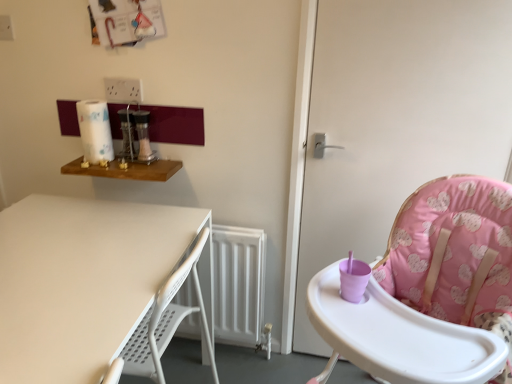
The image size is (512, 384). Identify the location of wooden shelf at upper left, positioned as the 2th table in bottom-to-top order. (126, 170).

This screenshot has height=384, width=512. What do you see at coordinates (95, 131) in the screenshot? I see `white paper towel at upper left` at bounding box center [95, 131].

Where is `white matte table at lower left, which is the first table in bottom-to-top order`? The image size is (512, 384). white matte table at lower left, which is the first table in bottom-to-top order is located at coordinates (81, 281).

Measure the distance between white matte table at lower left, which is the first table in bottom-to-top order, and camera.

They are 32.70 inches apart.

What do you see at coordinates (396, 120) in the screenshot?
I see `pink fabric high chair at right` at bounding box center [396, 120].

What is the approximate width of pink fabric high chair at right?

pink fabric high chair at right is 7.36 centimeters in width.

The height and width of the screenshot is (384, 512). I want to click on wooden shelf at upper left, positioned as the 2th table in bottom-to-top order, so click(126, 170).

Which object is positioned more to the left, wooden shelf at upper left, positioned as the 2th table in bottom-to-top order, or pink fabric high chair at right?

wooden shelf at upper left, positioned as the 2th table in bottom-to-top order.

From the picture: Considering the sizes of wooden shelf at upper left, positioned as the 2th table in bottom-to-top order, and pink fabric high chair at right in the image, is wooden shelf at upper left, positioned as the 2th table in bottom-to-top order, bigger or smaller than pink fabric high chair at right?

Clearly, wooden shelf at upper left, positioned as the 2th table in bottom-to-top order, is smaller in size than pink fabric high chair at right.

Considering the relative sizes of wooden shelf at upper left, which ranks as the 1th table in top-to-bottom order, and pink fabric high chair at right in the image provided, is wooden shelf at upper left, which ranks as the 1th table in top-to-bottom order, wider than pink fabric high chair at right?

Yes, wooden shelf at upper left, which ranks as the 1th table in top-to-bottom order, is wider than pink fabric high chair at right.

Which is behind, point (152, 169) or point (394, 131)?

The point (152, 169) is behind.

In the scene shown: What's the angular difference between white paper towel at upper left and white matte table at lower left, the 2th table from the top,'s facing directions?

90 degrees.

Is white paper towel at upper left placed right next to white matte table at lower left, the 2th table from the top?

No, white paper towel at upper left is not touching white matte table at lower left, the 2th table from the top.

Is point (101, 104) positioned behind point (71, 358)?

Yes, it is.

From the image's perspective, is white paper towel at upper left located above or below white matte table at lower left, the 2th table from the top?

Clearly, from the image's perspective, white paper towel at upper left is above white matte table at lower left, the 2th table from the top.

Would you say white matte table at lower left, the 2th table from the top, is inside or outside pink fabric high chair at right?

white matte table at lower left, the 2th table from the top, cannot be found inside pink fabric high chair at right.

Can you tell me how much white matte table at lower left, the 2th table from the top, and pink fabric high chair at right differ in facing direction?

white matte table at lower left, the 2th table from the top, and pink fabric high chair at right are facing 90 degrees away from each other.

Considering the positions of point (129, 313) and point (407, 194), is point (129, 313) closer or farther from the camera than point (407, 194)?

Point (129, 313) is positioned closer to the camera compared to point (407, 194).

Visually, is white matte table at lower left, the 2th table from the top, positioned to the left or to the right of pink fabric high chair at right?

Clearly, white matte table at lower left, the 2th table from the top, is on the left of pink fabric high chair at right in the image.

The width and height of the screenshot is (512, 384). I want to click on chair above the white matte table at lower left, the 2th table from the top (from a real-world perspective), so click(430, 290).

From the picture: Is pink fabric highchair at right bigger or smaller than white matte table at lower left, the 2th table from the top?

Clearly, pink fabric highchair at right is larger in size than white matte table at lower left, the 2th table from the top.

Visually, is pink fabric highchair at right positioned to the left or to the right of white matte table at lower left, which is the first table in bottom-to-top order?

In the image, pink fabric highchair at right appears on the right side of white matte table at lower left, which is the first table in bottom-to-top order.

From the image's perspective, which object appears higher, pink fabric highchair at right or white matte table at lower left, the 2th table from the top?

From the image's view, pink fabric highchair at right is above.

Does pink fabric highchair at right touch pink fabric high chair at right?

There is a gap between pink fabric highchair at right and pink fabric high chair at right.

From the image's perspective, who appears lower, pink fabric highchair at right or pink fabric high chair at right?

From the image's view, pink fabric highchair at right is below.

The height and width of the screenshot is (384, 512). Find the location of `screen door that is above the pink fabric highchair at right (from the image's perspective)`. screen door that is above the pink fabric highchair at right (from the image's perspective) is located at coordinates (396, 120).

Considering their positions, is pink fabric highchair at right located in front of or behind pink fabric high chair at right?

A: In the image, pink fabric highchair at right appears in front of pink fabric high chair at right.

Is point (100, 171) positioned behind point (45, 222)?

Yes, it is.

Is wooden shelf at upper left, which ranks as the 1th table in top-to-bottom order, wider or thinner than white matte table at lower left, the 2th table from the top?

Clearly, wooden shelf at upper left, which ranks as the 1th table in top-to-bottom order, has less width compared to white matte table at lower left, the 2th table from the top.

Can you confirm if wooden shelf at upper left, positioned as the 2th table in bottom-to-top order, is positioned to the left of white matte table at lower left, the 2th table from the top?

Indeed, wooden shelf at upper left, positioned as the 2th table in bottom-to-top order, is positioned on the left side of white matte table at lower left, the 2th table from the top.

Could you tell me if wooden shelf at upper left, which ranks as the 1th table in top-to-bottom order, is facing white matte table at lower left, the 2th table from the top?

No, wooden shelf at upper left, which ranks as the 1th table in top-to-bottom order, is not oriented towards white matte table at lower left, the 2th table from the top.

Can you confirm if white matte table at lower left, which is the first table in bottom-to-top order, is smaller than white paper towel at upper left?

No.

Is point (160, 239) positioned after point (89, 147)?

That is False.

Who is taller, white matte table at lower left, the 2th table from the top, or white paper towel at upper left?

white matte table at lower left, the 2th table from the top.

Who is more distant, white matte table at lower left, which is the first table in bottom-to-top order, or white paper towel at upper left?

white paper towel at upper left is more distant.

Which table is the 2nd one when counting from the left side of the pink fabric high chair at right? Please provide its 2D coordinates.

[(126, 170)]

I want to click on the 2nd table in front of the white paper towel at upper left, starting your count from the anchor, so click(81, 281).

When comparing their distances from white paper towel at upper left, does white matte table at lower left, which is the first table in bottom-to-top order, or pink fabric high chair at right seem further?

Among the two, pink fabric high chair at right is located further to white paper towel at upper left.

Which object lies further to the anchor point pink fabric high chair at right, wooden shelf at upper left, which ranks as the 1th table in top-to-bottom order, or white paper towel at upper left?

white paper towel at upper left lies further to pink fabric high chair at right than the other object.

Looking at the image, which one is located closer to white paper towel at upper left, pink fabric high chair at right or pink fabric highchair at right?

The object closer to white paper towel at upper left is pink fabric high chair at right.

Looking at this image, looking at the image, which one is located further to wooden shelf at upper left, which ranks as the 1th table in top-to-bottom order, white matte table at lower left, the 2th table from the top, or pink fabric high chair at right?

pink fabric high chair at right lies further to wooden shelf at upper left, which ranks as the 1th table in top-to-bottom order, than the other object.

Estimate the real-world distances between objects in this image. Which object is closer to pink fabric highchair at right, white paper towel at upper left or wooden shelf at upper left, positioned as the 2th table in bottom-to-top order?

The object closer to pink fabric highchair at right is wooden shelf at upper left, positioned as the 2th table in bottom-to-top order.

Estimate the real-world distances between objects in this image. Which object is further from pink fabric high chair at right, white paper towel at upper left or white matte table at lower left, the 2th table from the top?

white paper towel at upper left is positioned further to the anchor pink fabric high chair at right.

Considering their positions, is pink fabric highchair at right positioned closer to white paper towel at upper left than wooden shelf at upper left, which ranks as the 1th table in top-to-bottom order?

wooden shelf at upper left, which ranks as the 1th table in top-to-bottom order, is closer to white paper towel at upper left.

Considering their positions, is pink fabric highchair at right positioned closer to pink fabric high chair at right than white matte table at lower left, the 2th table from the top?

pink fabric highchair at right is closer to pink fabric high chair at right.

This screenshot has height=384, width=512. Find the location of `chair located between wooden shelf at upper left, positioned as the 2th table in bottom-to-top order, and pink fabric high chair at right in the left-right direction`. chair located between wooden shelf at upper left, positioned as the 2th table in bottom-to-top order, and pink fabric high chair at right in the left-right direction is located at coordinates (430, 290).

You are a GUI agent. You are given a task and a screenshot of the screen. Output one action in this format:
    pyautogui.click(x=<x>, y=<y>)
    Task: Click on the table between white paper towel at upper left and white matte table at lower left, the 2th table from the top, vertically
    The image size is (512, 384).
    Given the screenshot: What is the action you would take?
    pyautogui.click(x=126, y=170)

Where is `table between wooden shelf at upper left, which ranks as the 1th table in top-to-bottom order, and pink fabric highchair at right, in the horizontal direction`? table between wooden shelf at upper left, which ranks as the 1th table in top-to-bottom order, and pink fabric highchair at right, in the horizontal direction is located at coordinates (81, 281).

This screenshot has height=384, width=512. Find the location of `chair between white matte table at lower left, the 2th table from the top, and pink fabric high chair at right from left to right`. chair between white matte table at lower left, the 2th table from the top, and pink fabric high chair at right from left to right is located at coordinates (430, 290).